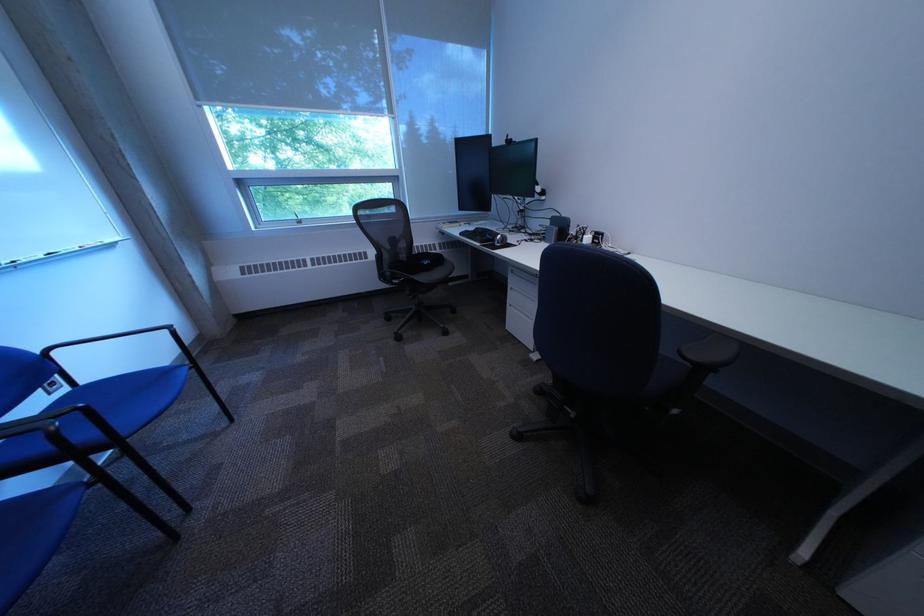
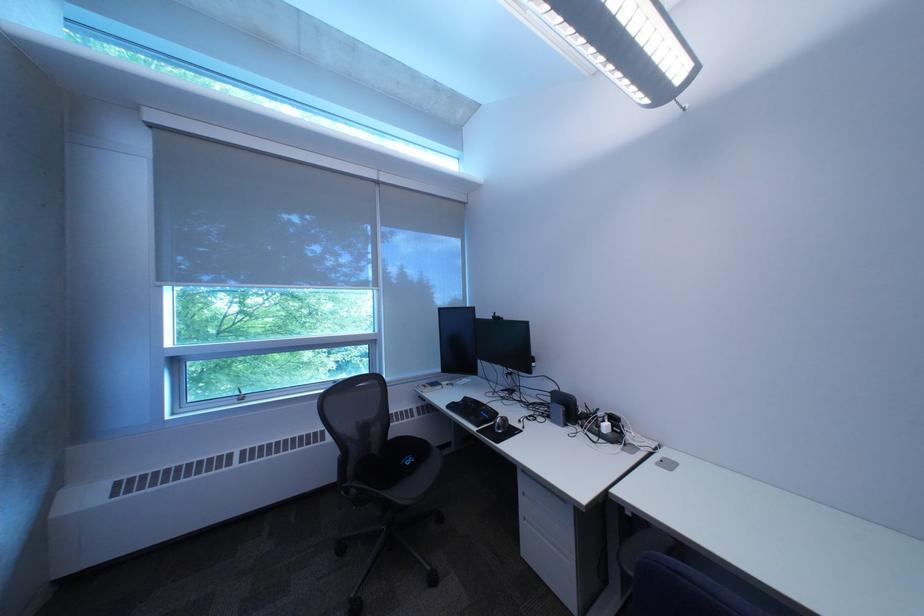
The point at (441, 262) is marked in the first image. Where is the corresponding point in the second image?

(423, 461)